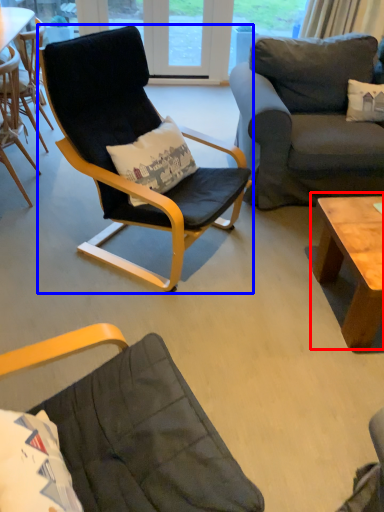
Question: Among these objects, which one is farthest to the camera, coffee table (highlighted by a red box) or chair (highlighted by a blue box)?

Choices:
 (A) coffee table
 (B) chair

Answer: (A)